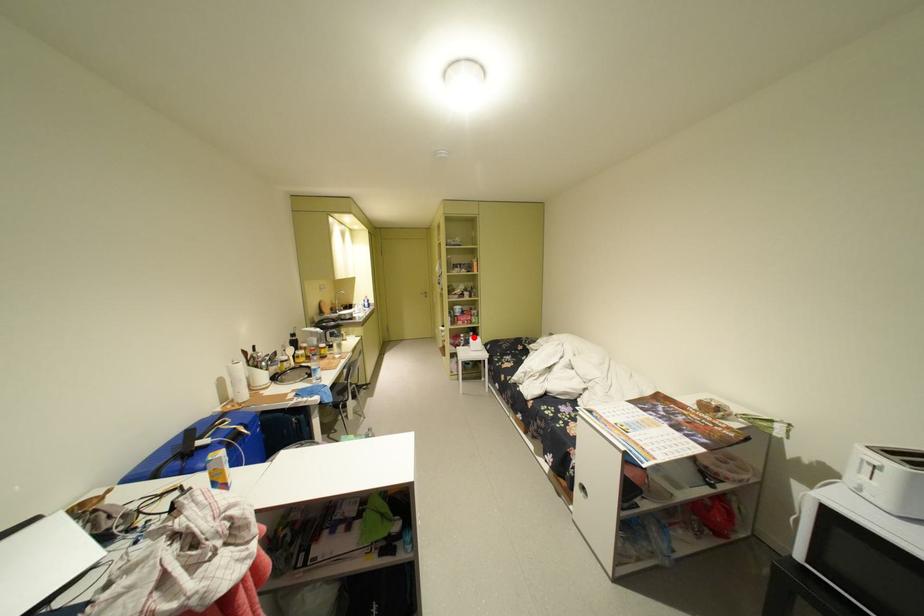
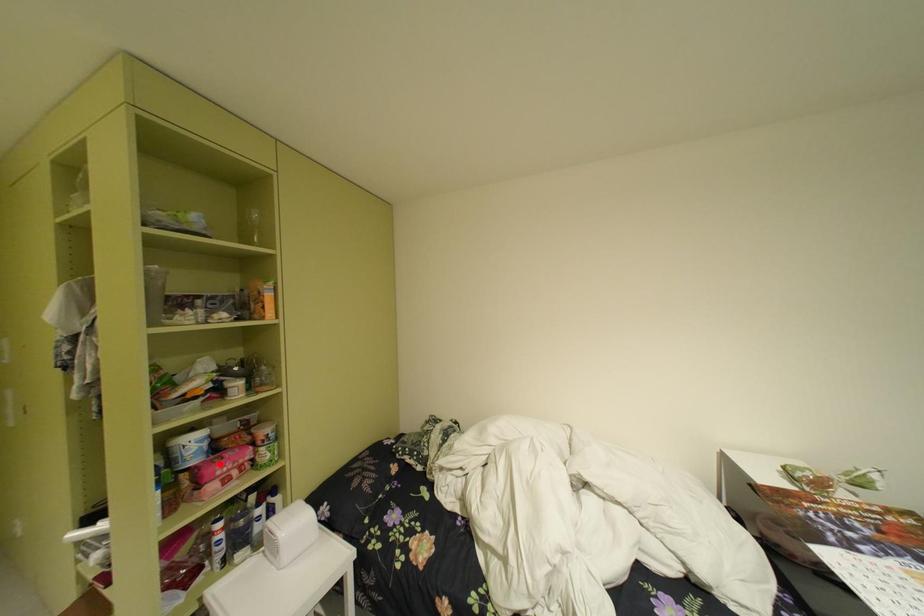
I am providing you with two images of the same scene from different viewpoints. A red point is marked on the first image and another point is marked on the second image. Is the marked point in image1 the same physical position as the marked point in image2?

No